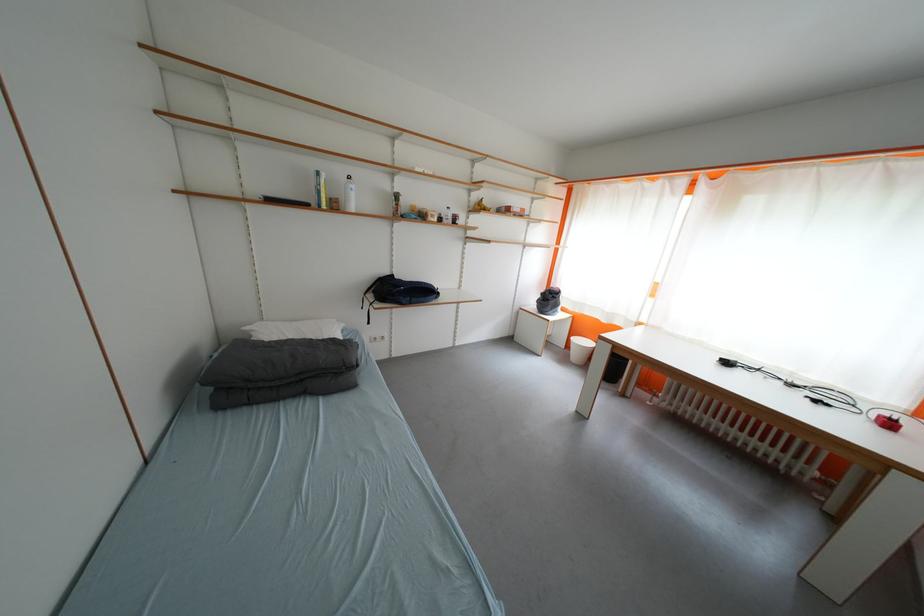
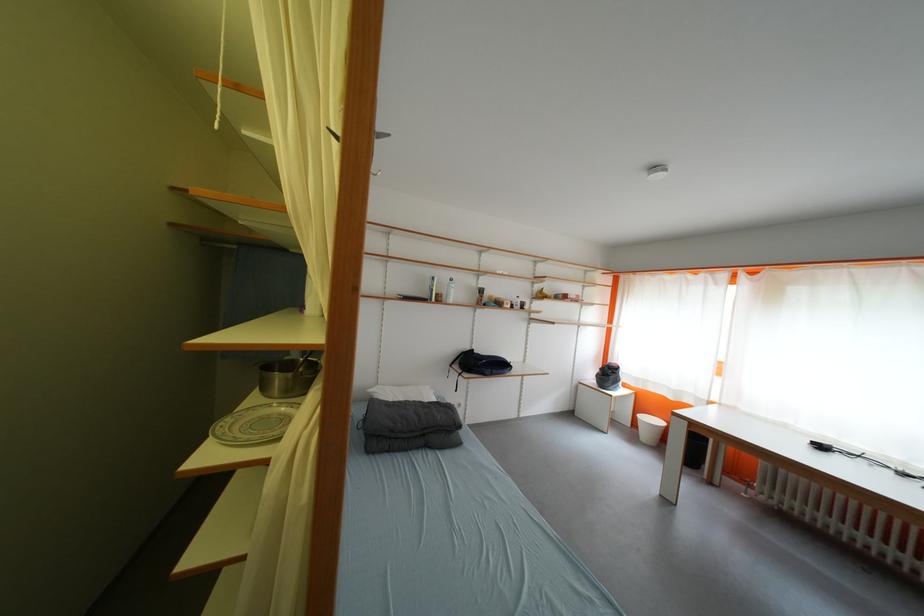
The point at (257,331) is marked in the first image. Where is the corresponding point in the second image?

(380, 392)